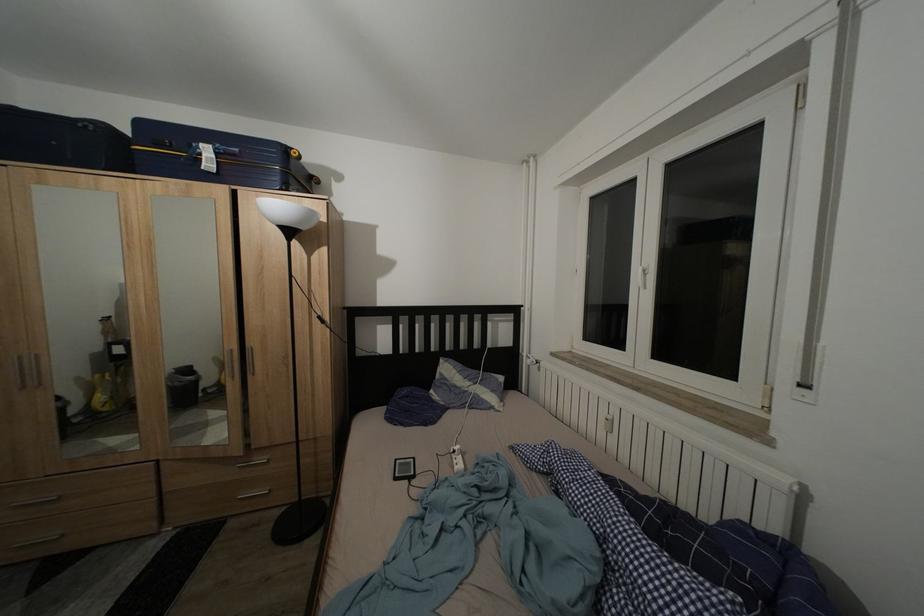
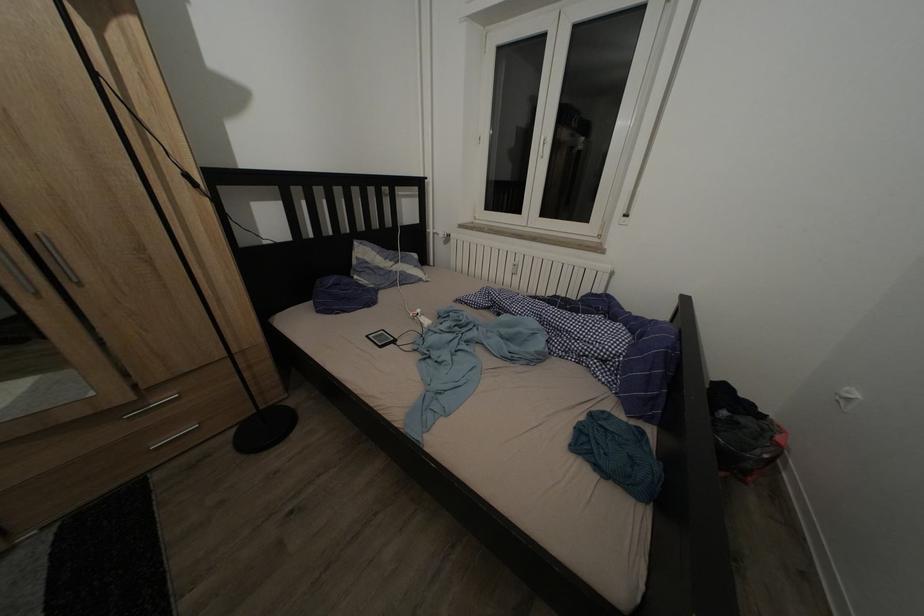
Based on the continuous images, in which direction is the camera rotating?

The rotation direction of the camera is right-down.